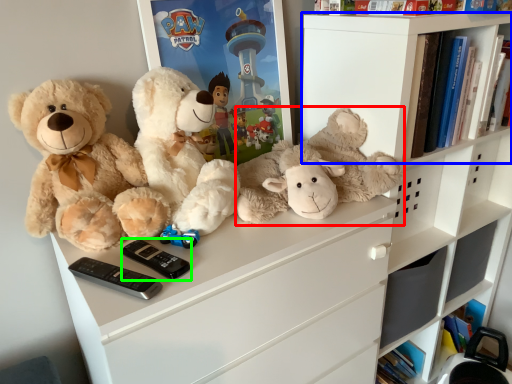
Question: Based on their relative distances, which object is nearer to teddy bear (highlighted by a red box)? Choose from shelf (highlighted by a blue box) and control (highlighted by a green box).

Choices:
 (A) shelf
 (B) control

Answer: (A)